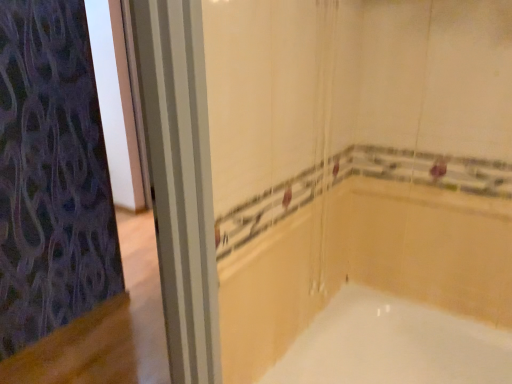
What do you see at coordinates (393, 345) in the screenshot? I see `white glossy jacuzzi at lower center` at bounding box center [393, 345].

Locate an element on the screen. Image resolution: width=512 pixels, height=384 pixels. white glossy jacuzzi at lower center is located at coordinates (393, 345).

You are a GUI agent. You are given a task and a screenshot of the screen. Output one action in this format:
    pyautogui.click(x=<x>, y=<y>)
    Task: Click on the white glossy jacuzzi at lower center
    This screenshot has height=384, width=512.
    Given the screenshot: What is the action you would take?
    pyautogui.click(x=393, y=345)